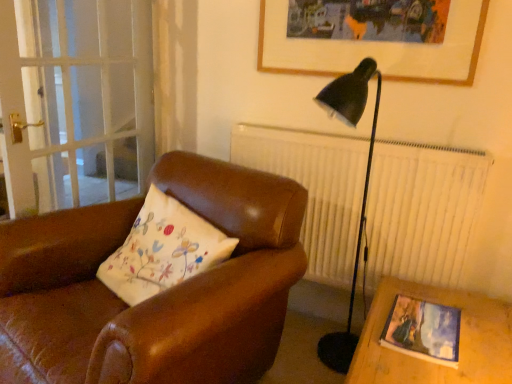
Find the location of a particular element. free space above wooden picture frame at upper center, which appears as the 2th picture frame when ordered from the bottom (from a real-world perspective) is located at coordinates (367, 0).